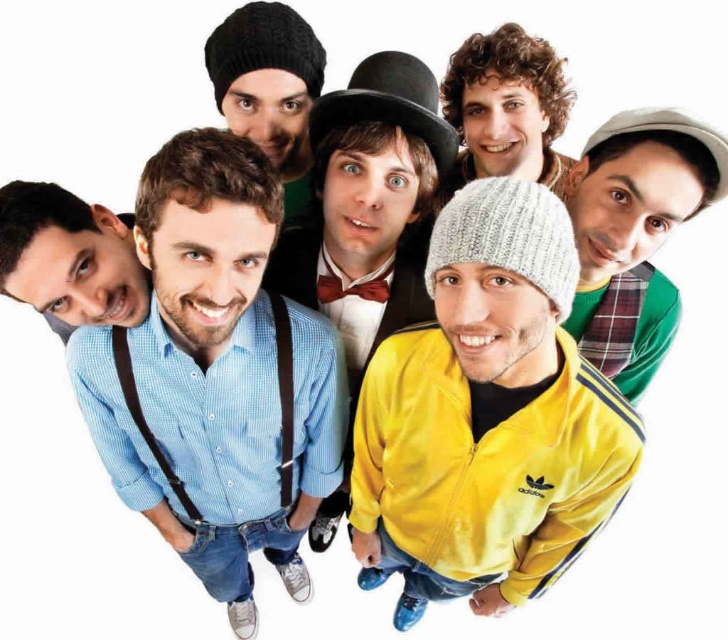
From the picture: Who is positioned more to the left, curly hair at upper center or knit beanie at upper left?

Positioned to the left is knit beanie at upper left.

Is curly hair at upper center positioned behind knit beanie at upper left?

Yes, it is behind knit beanie at upper left.

Is point (513, 54) less distant than point (301, 76)?

No, it is behind (301, 76).

The width and height of the screenshot is (728, 640). I want to click on curly hair at upper center, so click(505, 106).

Between yellow fabric jacket at center and gray knit beanie at center, which one appears on the left side from the viewer's perspective?

yellow fabric jacket at center

Can you confirm if yellow fabric jacket at center is positioned above gray knit beanie at center?

Incorrect, yellow fabric jacket at center is not positioned above gray knit beanie at center.

Who is more forward, (352, 81) or (605, 173)?

Positioned in front is point (605, 173).

I want to click on yellow fabric jacket at center, so click(365, 220).

Does yellow matte jacket at center appear over gray knit beanie at center?

No, yellow matte jacket at center is not above gray knit beanie at center.

How much distance is there between yellow matte jacket at center and gray knit beanie at center?

A distance of 15.67 inches exists between yellow matte jacket at center and gray knit beanie at center.

At what (x,y) coordinates should I click in order to perform the action: click on yellow matte jacket at center. Please return your answer as a coordinate pair (x, y). The width and height of the screenshot is (728, 640). Looking at the image, I should click on (486, 417).